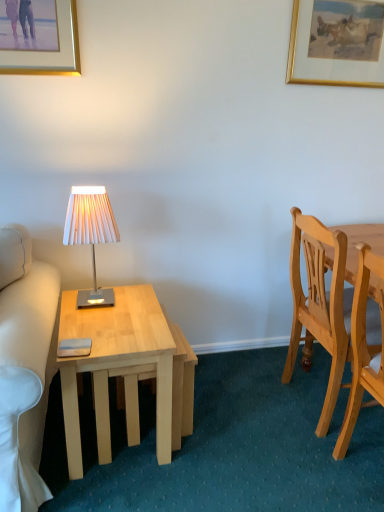
Where is `blank space situated above light wood desk at left (from a real-world perspective)`? This screenshot has height=512, width=384. blank space situated above light wood desk at left (from a real-world perspective) is located at coordinates (117, 318).